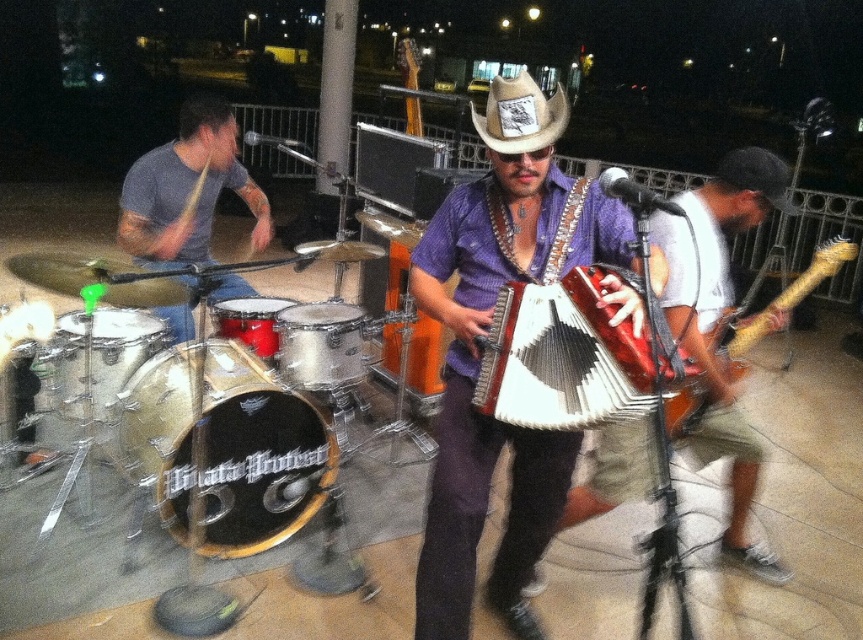
You are standing in the crowd watching the nighttime musical performance. You want to take a photo of the matte purple shirt at center without moving your position. Is the distance sufficient to capture the entire shirt in the frame?

The matte purple shirt at center is 5.81 feet away from viewer, so yes, the distance is sufficient to capture the entire shirt in the frame as 5.81 feet is a reasonable distance for photography.

You are standing in the audience at the nighttime outdoor musical performance. You want to toss a small flower bouquet to the performer wearing the purple fabric shirt at center. The maximum distance you can throw is 5 feet. Can you reach them?

The distance between you and the purple fabric shirt at center is 5.18 feet, which is slightly beyond your throwing range of 5 feet. You cannot reach them with the bouquet.